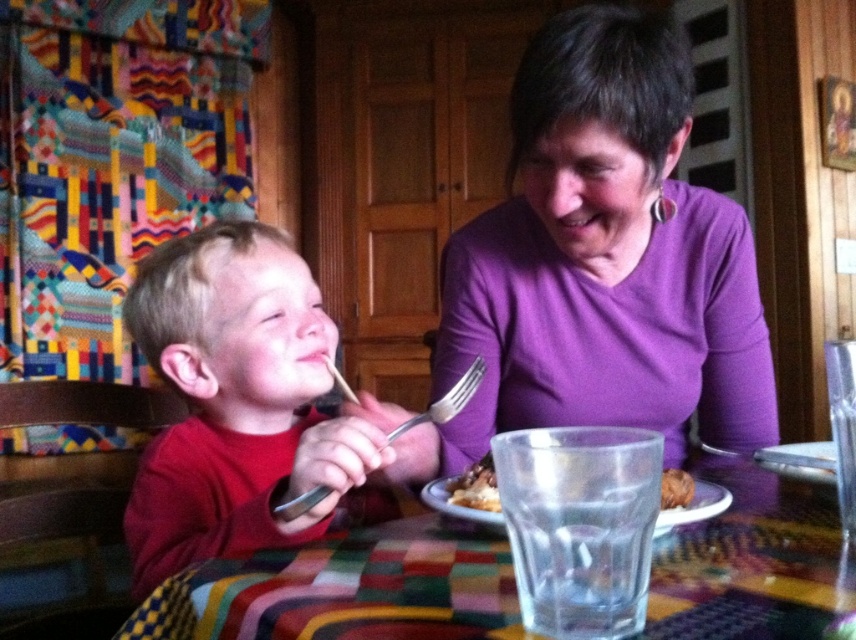
The point at coordinates (346, 589) is located on which object in the scene?

The point at coordinates (346, 589) is located on the multicolored woven tablecloth at center.

You are a chef who needs to place a new dish on the table. The dish requires exactly 8 inches of space between it and the multicolored woven tablecloth at center. Can you place the brown crumbly bread at lower center in the required position?

The distance between the multicolored woven tablecloth at center and the brown crumbly bread at lower center is 7.03 inches, which is less than the required 8 inches. Therefore, the brown crumbly bread at lower center cannot be placed in the required position.

You are standing in the dining area and want to place a decorative plate exactly between the young child wearing a red long sleeved shirt and the purple matte shirt at upper center. According to their positions, where should you place the plate?

The purple matte shirt at upper center is located at point (604, 259). To place the plate exactly between the two, calculate the midpoint between the child and the shirt. However, since only the shirt has coordinates provided, the exact position of the child isn